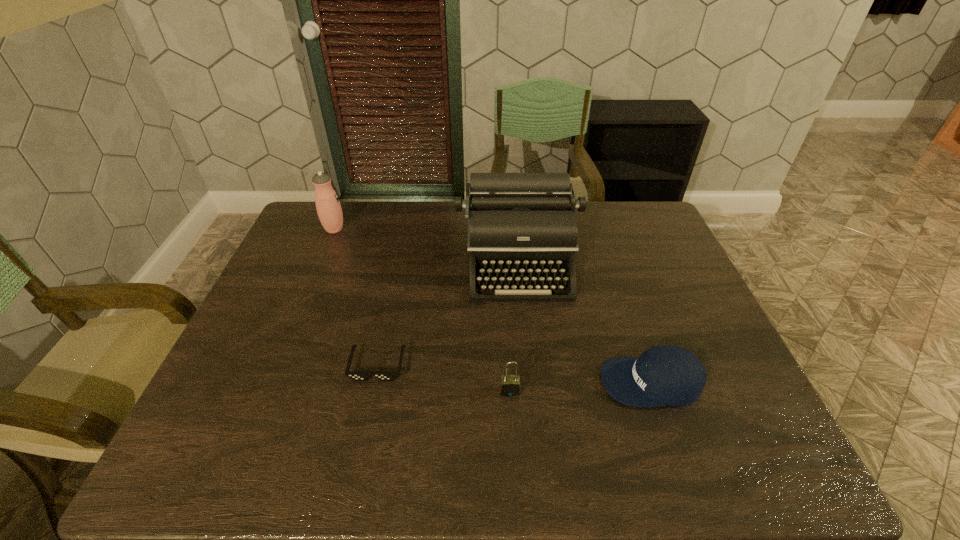
Locate an element on the screen. Image resolution: width=960 pixels, height=540 pixels. thermos bottle is located at coordinates (329, 210).

Where is `typewriter`? The width and height of the screenshot is (960, 540). typewriter is located at coordinates (521, 227).

Identify the location of padlock. (509, 385).

Where is `the fourth tallest object`? Image resolution: width=960 pixels, height=540 pixels. the fourth tallest object is located at coordinates (663, 375).

Where is `the shortest object`? This screenshot has height=540, width=960. the shortest object is located at coordinates (355, 375).

Locate an element on the screen. The image size is (960, 540). sunglasses is located at coordinates (355, 375).

This screenshot has height=540, width=960. What are the coordinates of `blank area located 0.250m on the right of the leftmost object` in the screenshot? It's located at (420, 230).

Find the location of a particular element. vacant space located 0.180m on the typing side of the typewriter is located at coordinates (528, 353).

Identify the location of free space located on the shackle of the third shortest object. (514, 461).

At what (x,y) coordinates should I click in order to perform the action: click on vacant region located on the front-facing side of the baseball cap. Please return your answer as a coordinate pair (x, y). Image resolution: width=960 pixels, height=540 pixels. Looking at the image, I should click on (580, 382).